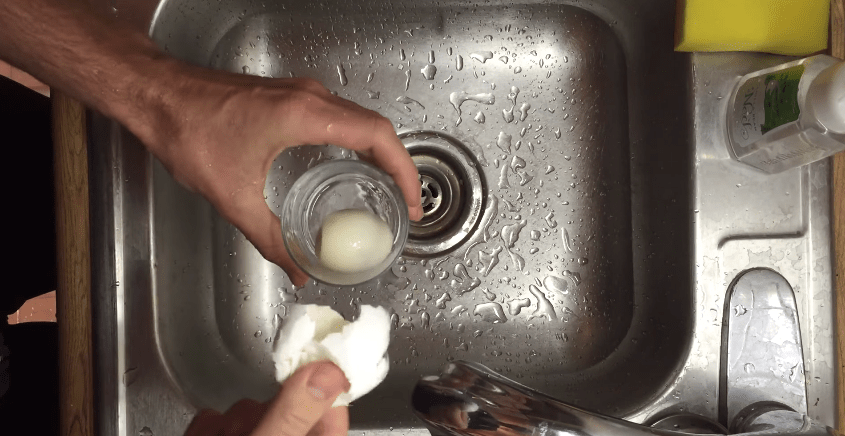
Identify the location of sponge. Image resolution: width=845 pixels, height=436 pixels. (722, 14).